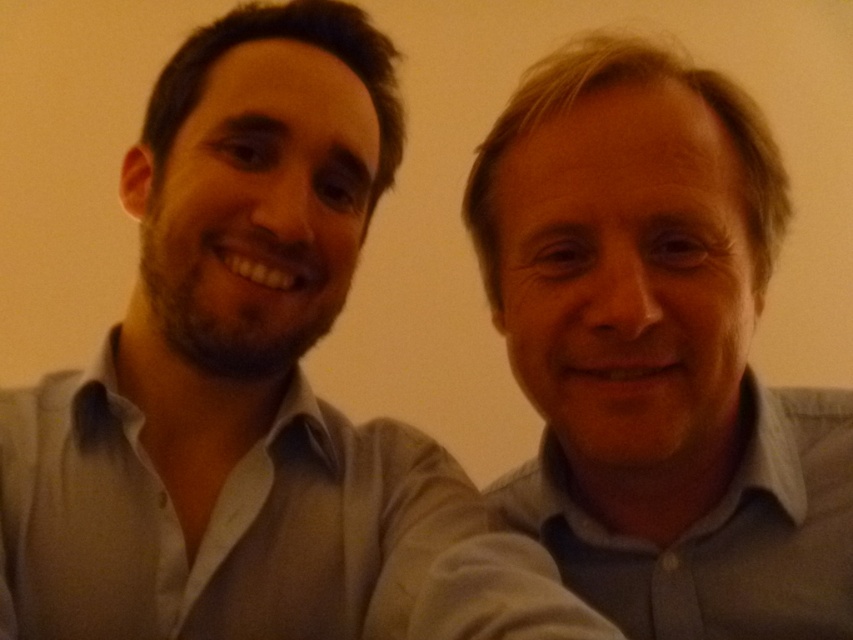
Question: Which of the following is the closest to the observer?

Choices:
 (A) (740, 172)
 (B) (181, 100)

Answer: (A)

Question: Observing the image, what is the correct spatial positioning of gray shirt at right in reference to gray cotton shirt at right?

Choices:
 (A) right
 (B) left

Answer: (B)

Question: Which point is closer to the camera?

Choices:
 (A) (817, 589)
 (B) (152, 582)

Answer: (B)

Question: Does gray shirt at right appear under gray cotton shirt at right?

Choices:
 (A) no
 (B) yes

Answer: (A)

Question: Is gray shirt at right positioned behind gray cotton shirt at right?

Choices:
 (A) no
 (B) yes

Answer: (A)

Question: Which point is closer to the camera taking this photo?

Choices:
 (A) (659, 406)
 (B) (206, 593)

Answer: (A)